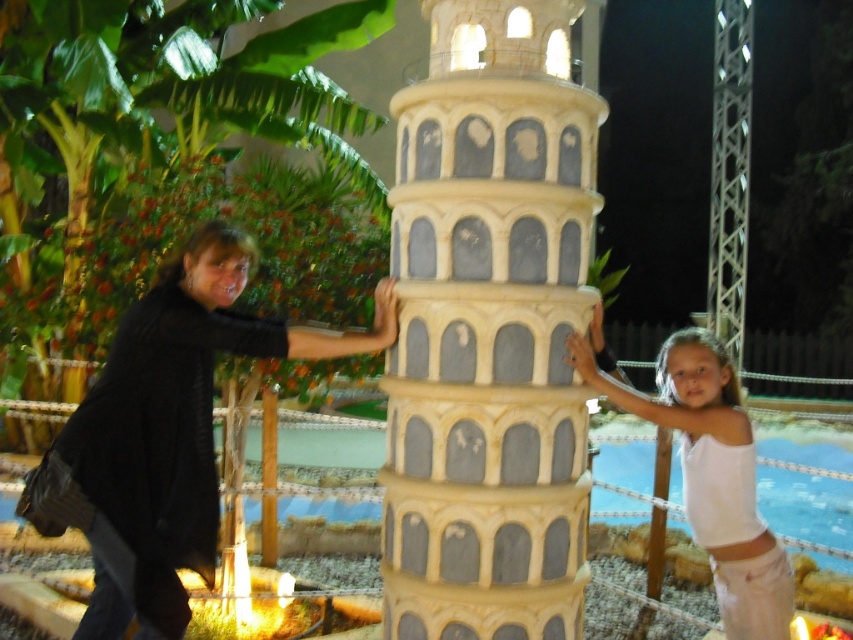
Question: Is stone-like tower at center smaller than black matte shirt at left?

Choices:
 (A) yes
 (B) no

Answer: (A)

Question: Does stone-like tower at center appear on the right side of black matte shirt at left?

Choices:
 (A) yes
 (B) no

Answer: (A)

Question: Which is farther from the white cotton tank top at center?

Choices:
 (A) black matte shirt at left
 (B) stone-like tower at center

Answer: (A)

Question: Which point is farther to the camera?

Choices:
 (A) (476, 113)
 (B) (190, 504)
 (C) (740, 474)

Answer: (B)

Question: Is stone-like tower at center in front of white cotton tank top at center?

Choices:
 (A) no
 (B) yes

Answer: (B)

Question: Which is farther from the black matte shirt at left?

Choices:
 (A) stone-like tower at center
 (B) white cotton tank top at center

Answer: (B)